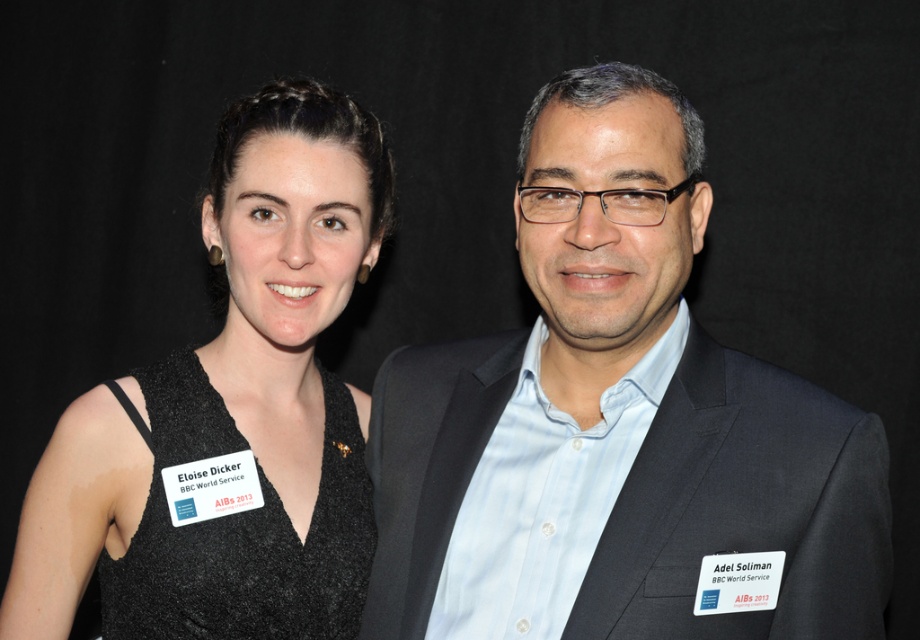
Does matte black suit at center appear on the left side of black textured dress at left?

No, matte black suit at center is not to the left of black textured dress at left.

Does point (590, 634) come closer to viewer compared to point (116, 499)?

Yes, point (590, 634) is closer to viewer.

Is point (382, 506) positioned before point (240, 236)?

No.

At what (x,y) coordinates should I click in order to perform the action: click on matte black suit at center. Please return your answer as a coordinate pair (x, y). Looking at the image, I should click on (618, 426).